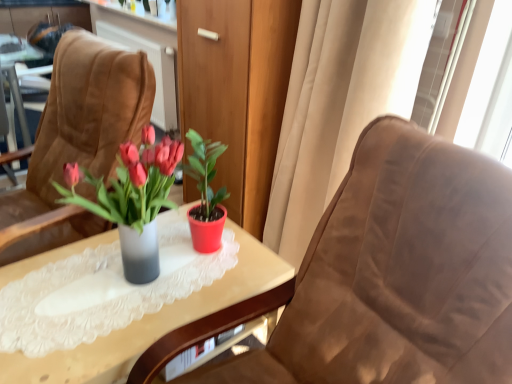
Question: From the image's perspective, is suede chair at center, the first chair when ordered from right to left, located above suede chair at left, the second chair in the right-to-left sequence?

Choices:
 (A) yes
 (B) no

Answer: (B)

Question: Can you confirm if suede chair at center, which ranks as the 2th chair in left-to-right order, is bigger than suede chair at left, the second chair in the right-to-left sequence?

Choices:
 (A) no
 (B) yes

Answer: (B)

Question: Is suede chair at center, which ranks as the 2th chair in left-to-right order, beside suede chair at left, placed as the first chair when sorted from left to right?

Choices:
 (A) no
 (B) yes

Answer: (A)

Question: From the image's perspective, does suede chair at center, which ranks as the 2th chair in left-to-right order, appear lower than suede chair at left, placed as the first chair when sorted from left to right?

Choices:
 (A) no
 (B) yes

Answer: (B)

Question: Can you confirm if suede chair at center, which ranks as the 2th chair in left-to-right order, is smaller than suede chair at left, the second chair in the right-to-left sequence?

Choices:
 (A) yes
 (B) no

Answer: (B)

Question: Is suede chair at center, which ranks as the 2th chair in left-to-right order, to the left of suede chair at left, the second chair in the right-to-left sequence, from the viewer's perspective?

Choices:
 (A) yes
 (B) no

Answer: (B)

Question: Does suede chair at left, placed as the first chair when sorted from left to right, have a smaller size compared to translucent glass vase at center?

Choices:
 (A) yes
 (B) no

Answer: (B)

Question: Are suede chair at left, placed as the first chair when sorted from left to right, and translucent glass vase at center making contact?

Choices:
 (A) no
 (B) yes

Answer: (A)

Question: Is suede chair at left, placed as the first chair when sorted from left to right, positioned behind translucent glass vase at center?

Choices:
 (A) yes
 (B) no

Answer: (A)

Question: Can you confirm if suede chair at left, placed as the first chair when sorted from left to right, is taller than translucent glass vase at center?

Choices:
 (A) yes
 (B) no

Answer: (A)

Question: From the image's perspective, is suede chair at left, placed as the first chair when sorted from left to right, located above translucent glass vase at center?

Choices:
 (A) no
 (B) yes

Answer: (B)

Question: Considering the relative sizes of suede chair at left, placed as the first chair when sorted from left to right, and translucent glass vase at center in the image provided, is suede chair at left, placed as the first chair when sorted from left to right, bigger than translucent glass vase at center?

Choices:
 (A) yes
 (B) no

Answer: (A)

Question: Considering the relative sizes of beige fabric curtain at right and suede chair at left, the second chair in the right-to-left sequence, in the image provided, is beige fabric curtain at right wider than suede chair at left, the second chair in the right-to-left sequence,?

Choices:
 (A) yes
 (B) no

Answer: (B)